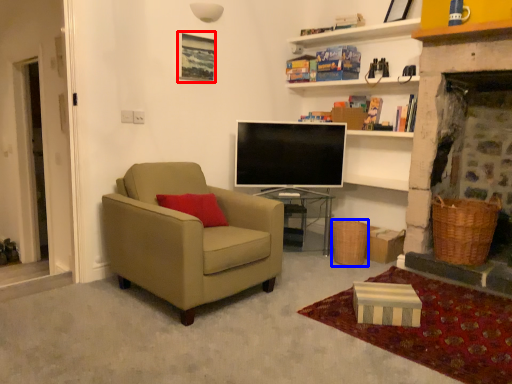
Question: Which object is closer to the camera taking this photo, picture frame (highlighted by a red box) or picnic basket (highlighted by a blue box)?

Choices:
 (A) picture frame
 (B) picnic basket

Answer: (A)